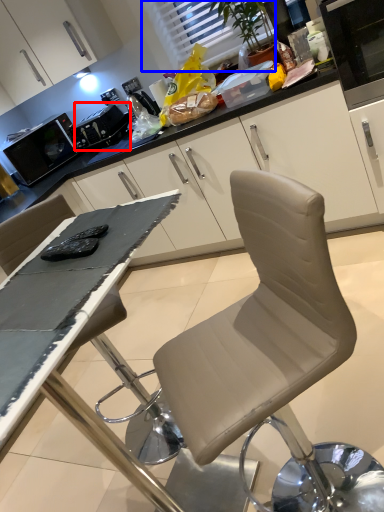
Question: Which object is further to the camera taking this photo, appliance (highlighted by a red box) or window (highlighted by a blue box)?

Choices:
 (A) appliance
 (B) window

Answer: (A)